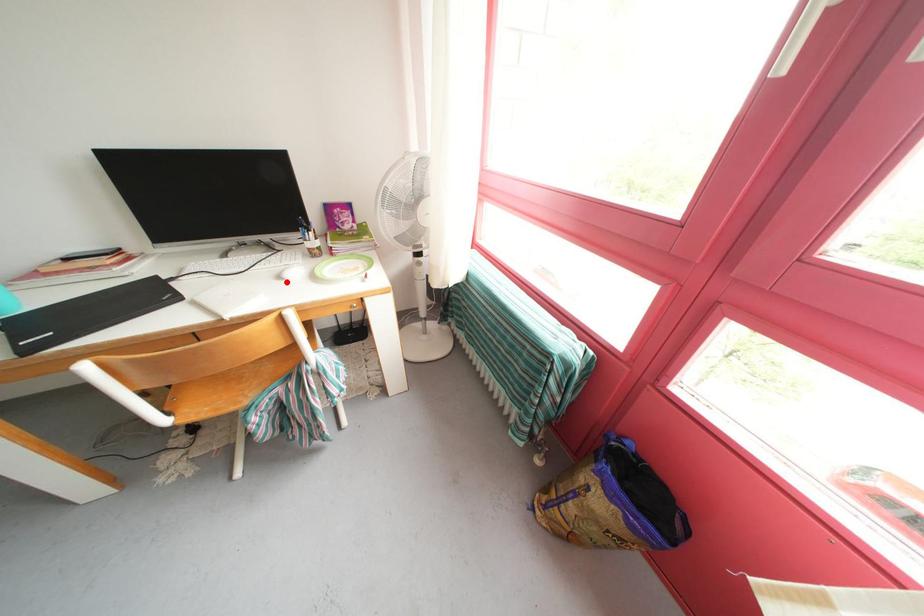
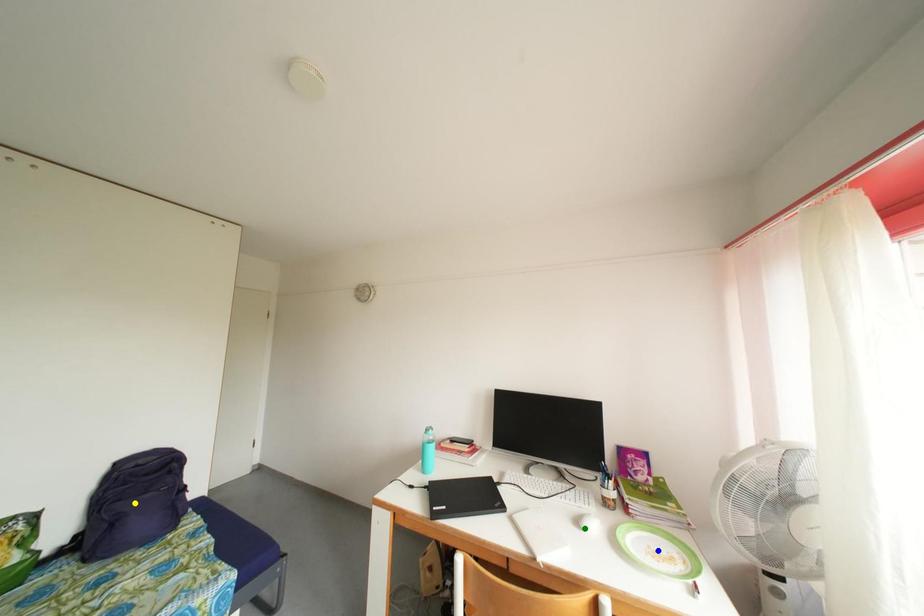
Question: I am providing you with two images of the same scene from different viewpoints. A red point is marked on the first image. You are given multiple points on the second image. Which point in image 2 represents the same 3d spot as the red point in image 1?

Choices:
 (A) yellow point
 (B) green point
 (C) blue point

Answer: (B)